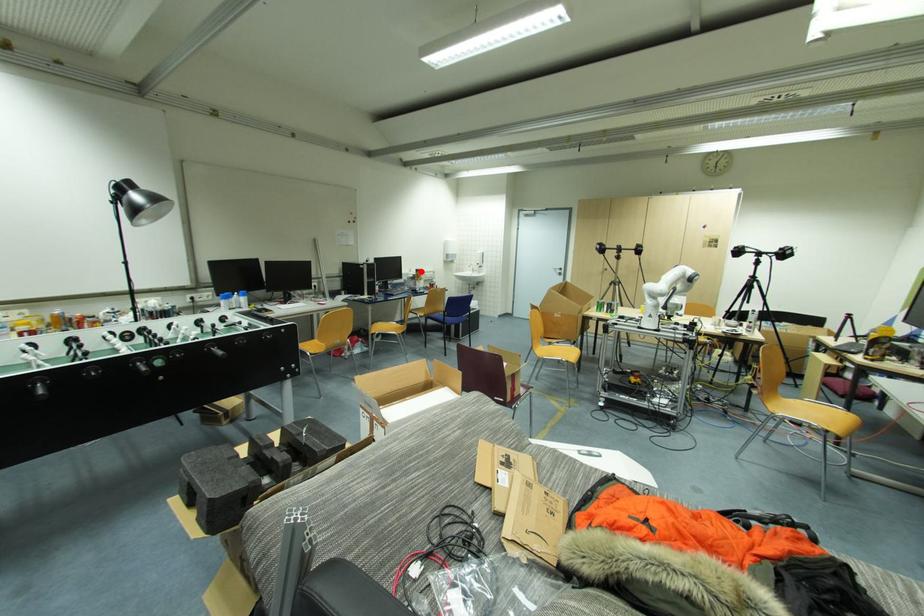
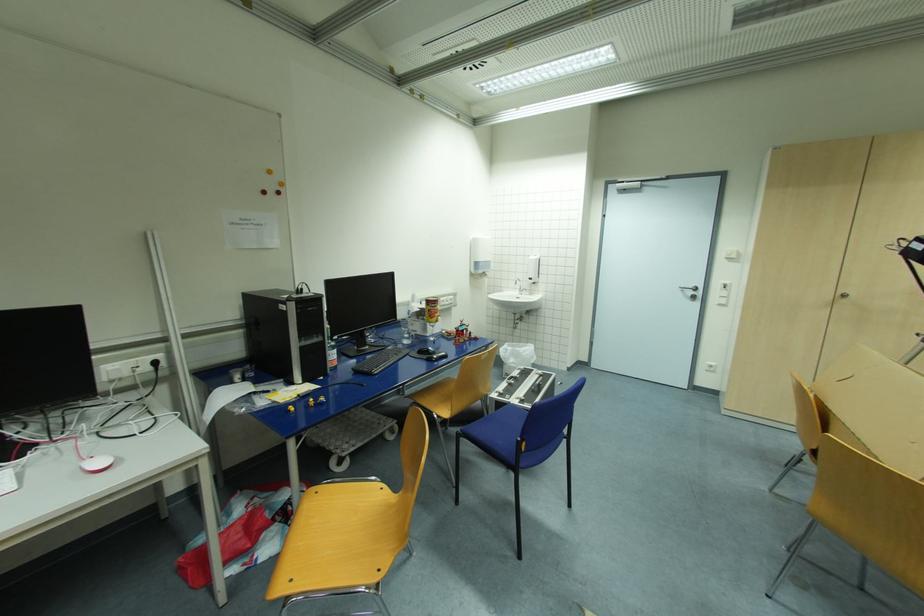
In the second image, find the point that corresponds to the highlighted location in the first image.

(433, 302)